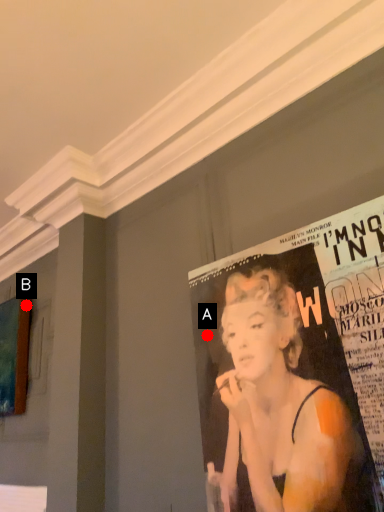
Question: Two points are circled on the image, labeled by A and B beside each circle. Which of the following is the closest to the observer?

Choices:
 (A) A is closer
 (B) B is closer

Answer: (A)